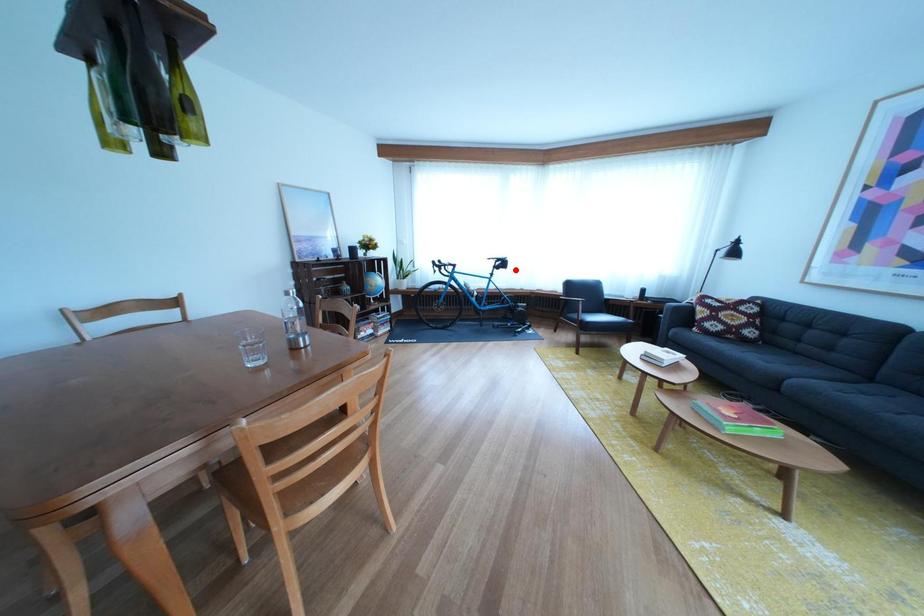
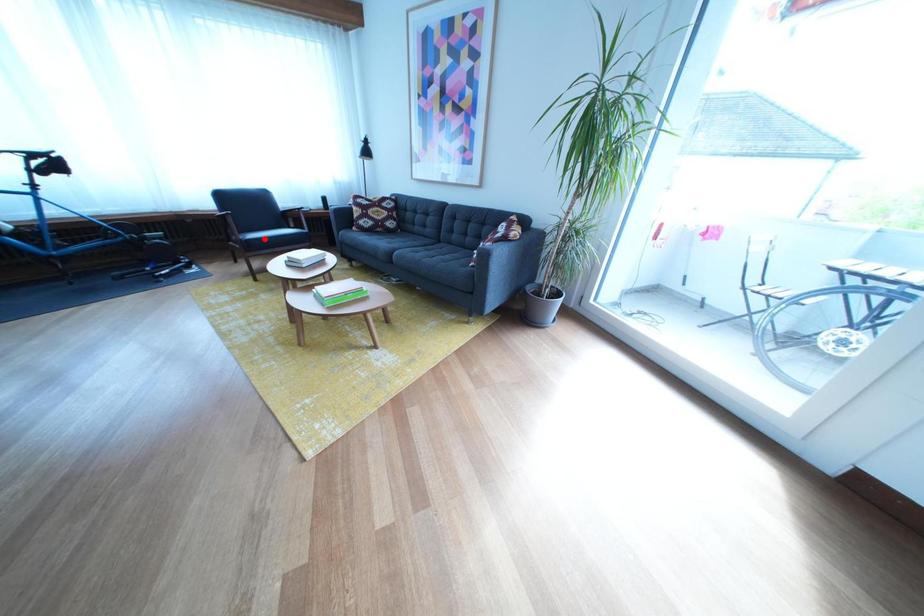
I am providing you with two images of the same scene from different viewpoints. A red point is marked on the first image and another point is marked on the second image. Are the points marked in image1 and image2 representing the same 3D position?

No